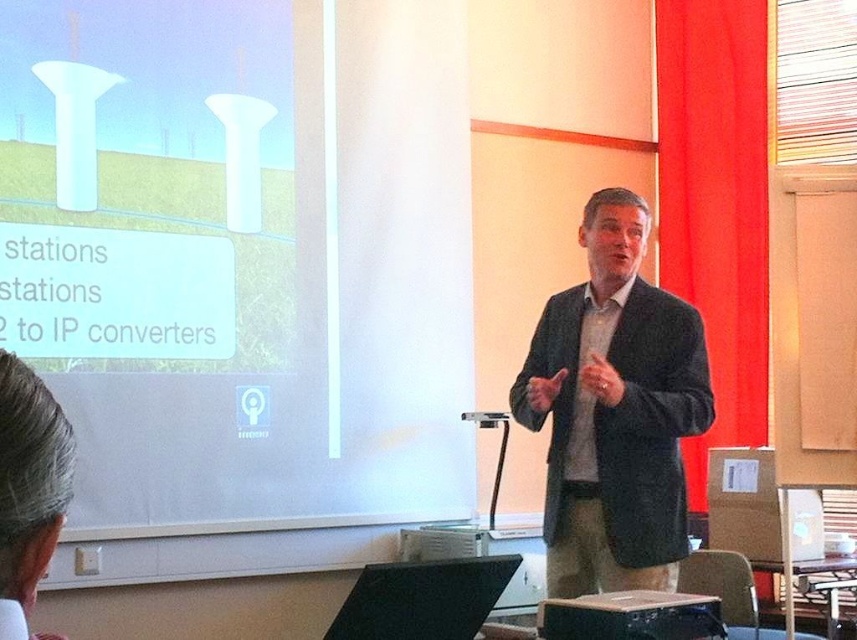
Based on the photo, is white matte projection screen at upper left positioned before dark gray suit at center?

No, it is not.

Is white matte projection screen at upper left taller than dark gray suit at center?

Indeed, white matte projection screen at upper left has a greater height compared to dark gray suit at center.

Describe the element at coordinates (243, 256) in the screenshot. The height and width of the screenshot is (640, 857). I see `white matte projection screen at upper left` at that location.

At what (x,y) coordinates should I click in order to perform the action: click on white matte projection screen at upper left. Please return your answer as a coordinate pair (x, y). Looking at the image, I should click on (243, 256).

Does white matte projection screen at upper left appear on the left side of gray hair at lower left?

Indeed, white matte projection screen at upper left is positioned on the left side of gray hair at lower left.

Does point (469, 509) come farther from viewer compared to point (4, 472)?

That is True.

Image resolution: width=857 pixels, height=640 pixels. Identify the location of white matte projection screen at upper left. (243, 256).

Is point (556, 518) positioned after point (57, 404)?

Yes, it is behind point (57, 404).

In the scene shown: Can you confirm if dark gray suit at center is bigger than gray hair at lower left?

Yes.

Between point (615, 509) and point (15, 552), which one is positioned behind?

Point (615, 509)

You are a GUI agent. You are given a task and a screenshot of the screen. Output one action in this format:
    pyautogui.click(x=<x>, y=<y>)
    Task: Click on the dark gray suit at center
    
    Given the screenshot: What is the action you would take?
    pyautogui.click(x=614, y=412)